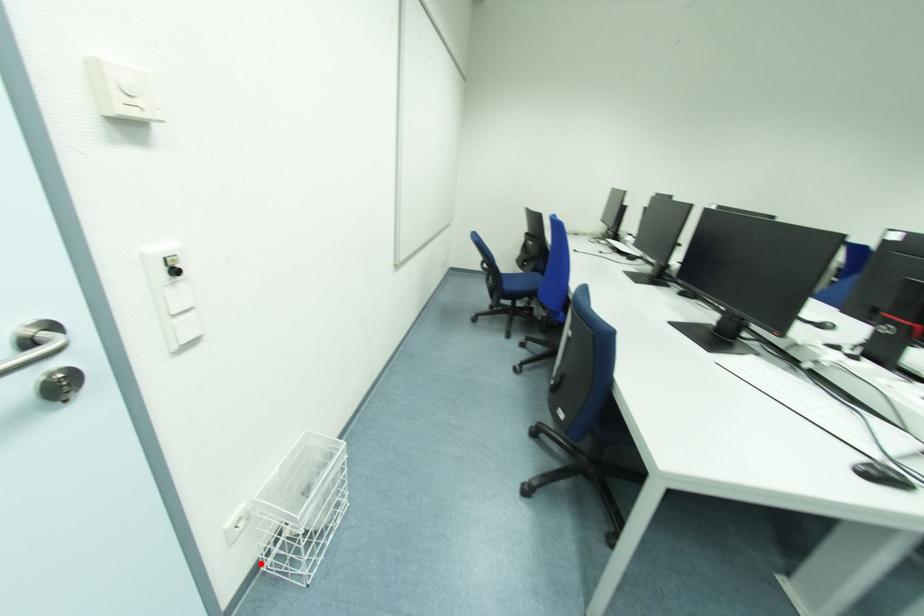
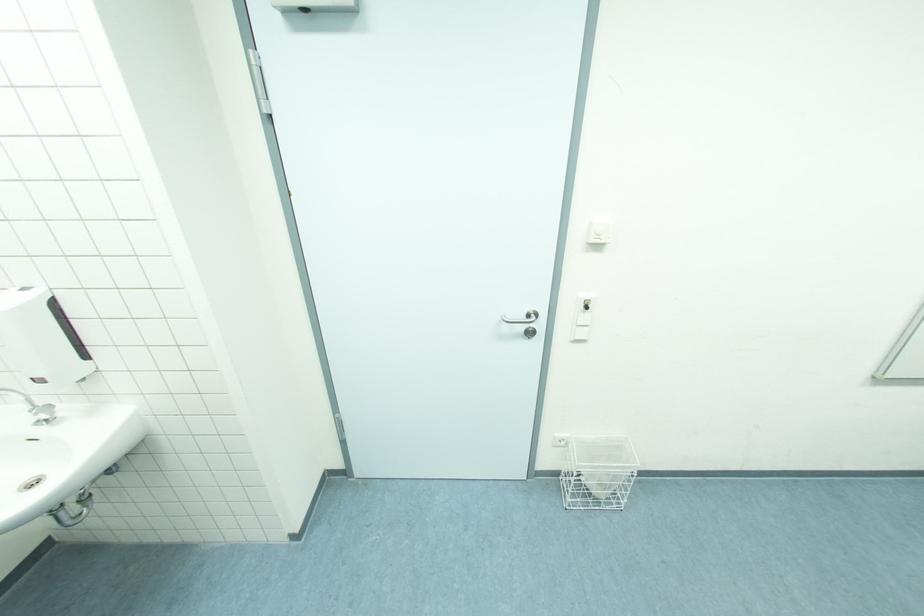
In the second image, find the point that corresponds to the highlighted location in the first image.

(563, 472)